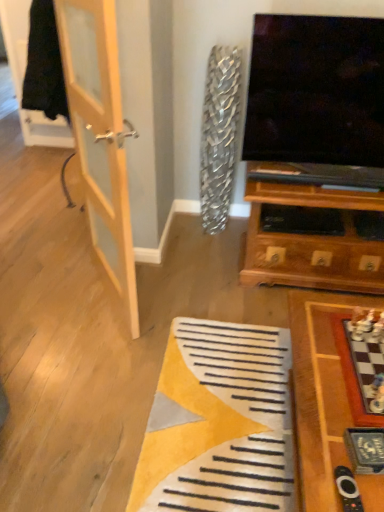
What are the coordinates of `empty space that is ontop of wooden chessboard at lower right (from a real-world perspective)` in the screenshot? It's located at (342, 386).